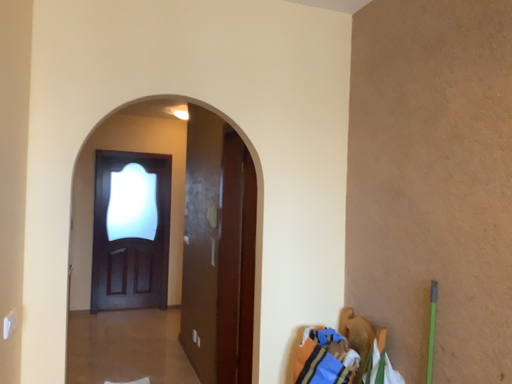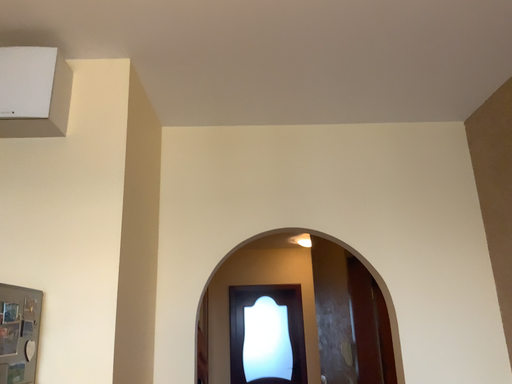
Question: How did the camera likely rotate when shooting the video?

Choices:
 (A) rotated left
 (B) rotated right

Answer: (A)